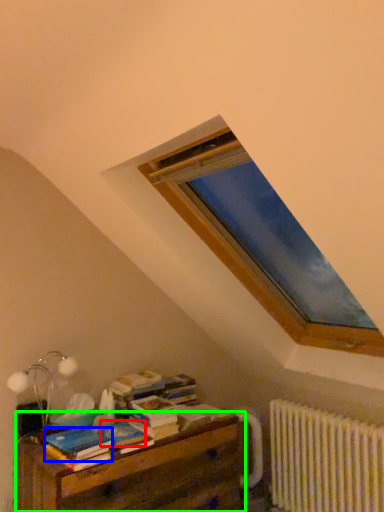
Question: Estimate the real-world distances between objects in this image. Which object is farther from paperback book (highlighted by a red box), paperback book (highlighted by a blue box) or nightstand (highlighted by a green box)?

Choices:
 (A) paperback book
 (B) nightstand

Answer: (B)